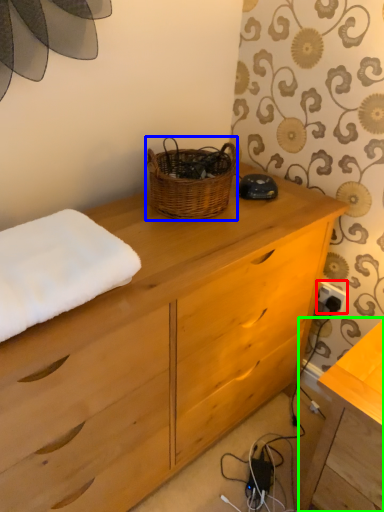
Question: Considering the real-world distances, which object is farthest from electric outlet (highlighted by a red box)? picnic basket (highlighted by a blue box) or table (highlighted by a green box)?

Choices:
 (A) picnic basket
 (B) table

Answer: (A)